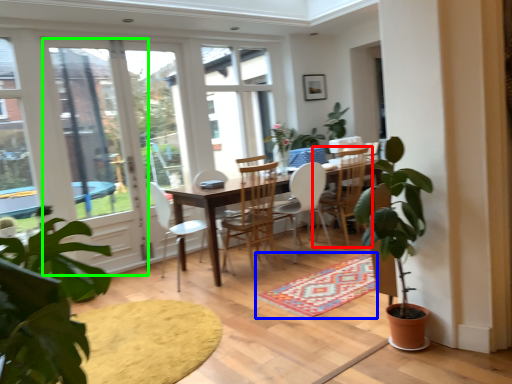
Question: Which is farther away from chair (highlighted by a red box)? carpets (highlighted by a blue box) or screen door (highlighted by a green box)?

Choices:
 (A) carpets
 (B) screen door

Answer: (B)